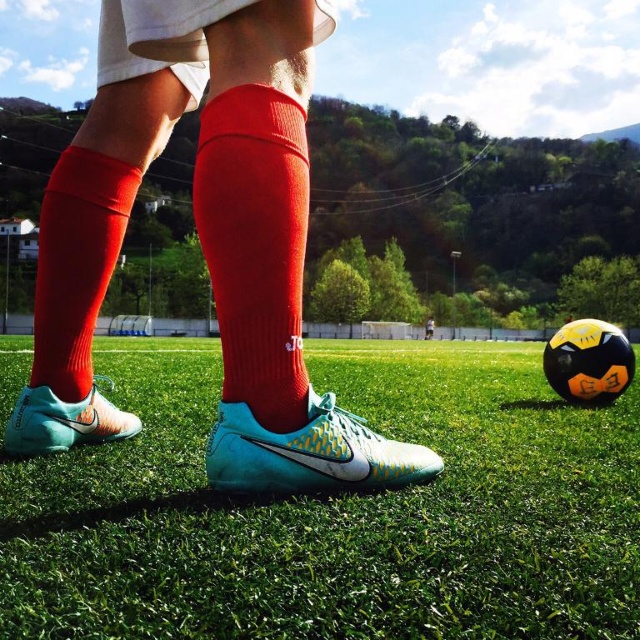
Question: Is knitted red sock at center closer to camera compared to teal matte nike cleat at center?

Choices:
 (A) no
 (B) yes

Answer: (B)

Question: Can you confirm if green artificial turf at center is bigger than teal matte nike cleat at center?

Choices:
 (A) yes
 (B) no

Answer: (A)

Question: Among these points, which one is nearest to the camera?

Choices:
 (A) (225, 477)
 (B) (8, 435)

Answer: (A)

Question: Considering the relative positions of red knit sock at lower left and teal matte soccer cleat at lower left in the image provided, where is red knit sock at lower left located with respect to teal matte soccer cleat at lower left?

Choices:
 (A) above
 (B) below

Answer: (A)

Question: Which object is the closest to the red knit sock at lower left?

Choices:
 (A) teal matte soccer cleat at lower left
 (B) teal matte nike cleat at center
 (C) knitted red sock at center
 (D) green artificial turf at center

Answer: (A)

Question: Among these objects, which one is nearest to the camera?

Choices:
 (A) red knit sock at lower left
 (B) green artificial turf at center

Answer: (B)